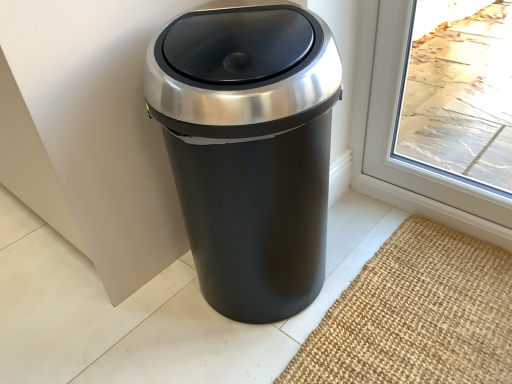
Find the location of a particular element. The width and height of the screenshot is (512, 384). free spot in front of matte black trash can at center is located at coordinates (281, 357).